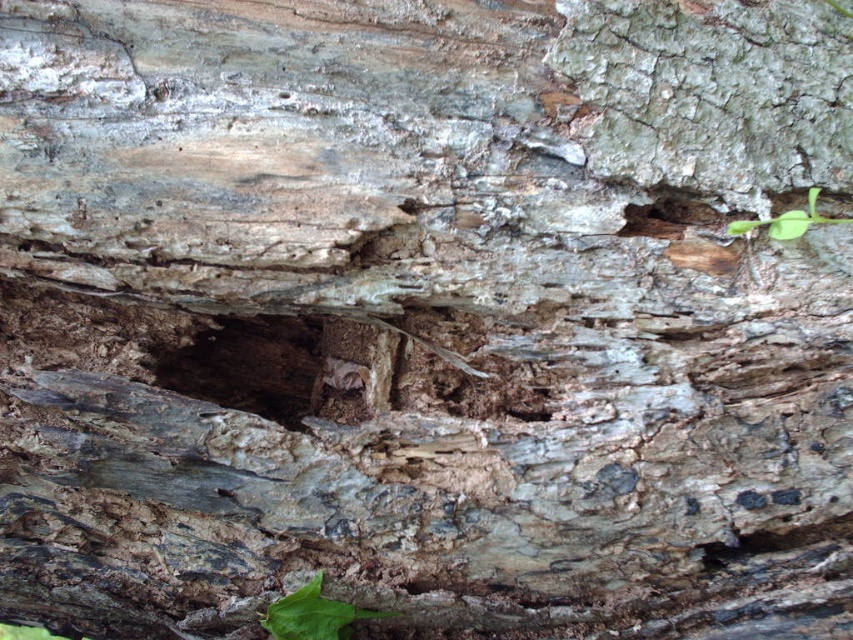
Question: Is dark wood hole at center bigger than green leafy plant at upper right?

Choices:
 (A) no
 (B) yes

Answer: (B)

Question: In this image, where is dark wood hole at center located relative to green leafy plant at lower center?

Choices:
 (A) above
 (B) below

Answer: (A)

Question: Is green leafy plant at lower center wider than green leafy plant at upper right?

Choices:
 (A) no
 (B) yes

Answer: (A)

Question: Which is farther from the dark wood hole at center?

Choices:
 (A) green leafy plant at lower center
 (B) green leafy plant at upper right

Answer: (B)

Question: Estimate the real-world distances between objects in this image. Which object is closer to the green leafy plant at upper right?

Choices:
 (A) dark wood hole at center
 (B) green leafy plant at lower center

Answer: (A)

Question: Which object is farther from the camera taking this photo?

Choices:
 (A) green leafy plant at upper right
 (B) green leafy plant at lower center
 (C) dark wood hole at center

Answer: (C)